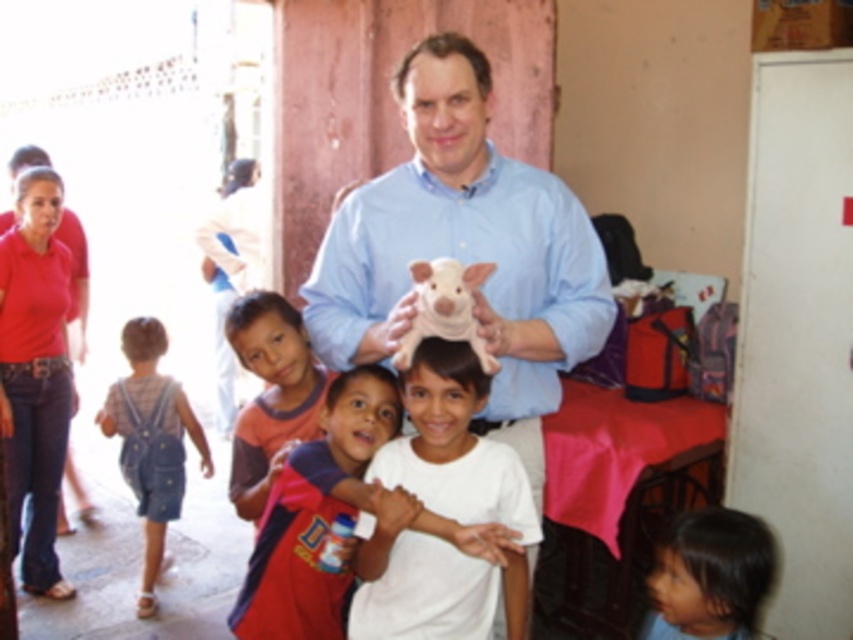
Which is more to the left, white cotton shirt at center or white plush pig at center?

From the viewer's perspective, white cotton shirt at center appears more on the left side.

Is white cotton shirt at center below white plush pig at center?

Yes, white cotton shirt at center is below white plush pig at center.

What do you see at coordinates (314, 515) in the screenshot? This screenshot has height=640, width=853. I see `white cotton shirt at center` at bounding box center [314, 515].

Where is `white cotton shirt at center`? white cotton shirt at center is located at coordinates (314, 515).

From the picture: Does white matte shirt at center come in front of dark brown hair at lower right?

That is True.

Can you confirm if white matte shirt at center is wider than dark brown hair at lower right?

Correct, the width of white matte shirt at center exceeds that of dark brown hair at lower right.

Identify the location of white matte shirt at center. The width and height of the screenshot is (853, 640). (454, 445).

Which of these two, blue smooth shirt at center or orange cotton shirt at lower left, stands taller?

Standing taller between the two is blue smooth shirt at center.

What do you see at coordinates (465, 250) in the screenshot? I see `blue smooth shirt at center` at bounding box center [465, 250].

The height and width of the screenshot is (640, 853). I want to click on blue smooth shirt at center, so (465, 250).